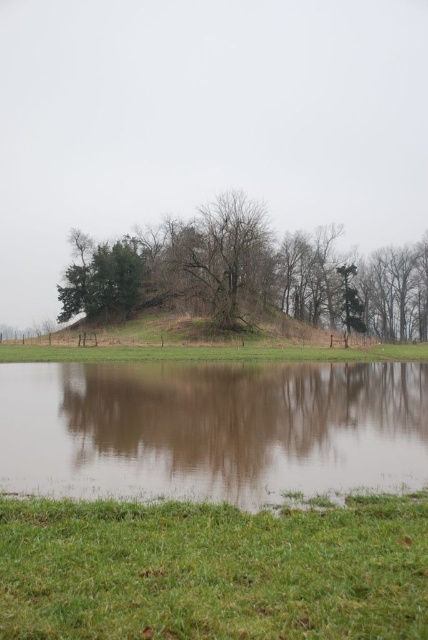
Question: Which object is positioned closest to the green matte tree at upper left?

Choices:
 (A) green grassy at lower center
 (B) green grassy field at center
 (C) green leafy tree at center

Answer: (C)

Question: Among these objects, which one is farthest from the camera?

Choices:
 (A) bare branches at center
 (B) green grassy at lower center

Answer: (A)

Question: Is brown reflective water at lower center thinner than green grassy field at center?

Choices:
 (A) no
 (B) yes

Answer: (B)

Question: Is brown reflective water at lower center further to the viewer compared to green leafy tree at center?

Choices:
 (A) yes
 (B) no

Answer: (B)

Question: Which point is closer to the camera taking this photo?

Choices:
 (A) (329, 244)
 (B) (67, 282)
 (C) (229, 515)

Answer: (C)

Question: From the image, what is the correct spatial relationship of brown reflective water at lower center in relation to green matte tree at upper left?

Choices:
 (A) above
 (B) below

Answer: (B)